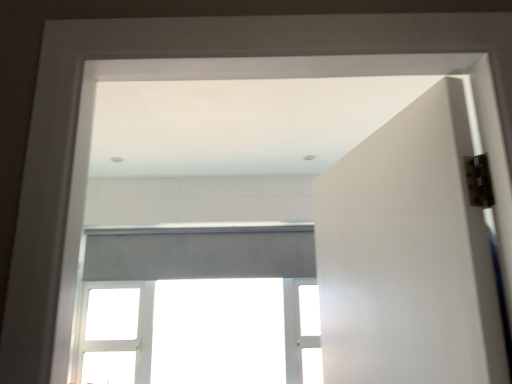
Question: Should I look upward or downward to see white matte door at right?

Choices:
 (A) down
 (B) up

Answer: (A)

Question: Considering the relative sizes of white matte door at right and white matte window at center in the image provided, is white matte door at right smaller than white matte window at center?

Choices:
 (A) yes
 (B) no

Answer: (A)

Question: From a real-world perspective, is white matte door at right located beneath white matte window at center?

Choices:
 (A) yes
 (B) no

Answer: (B)

Question: Is the position of white matte door at right less distant than that of white matte window at center?

Choices:
 (A) no
 (B) yes

Answer: (B)

Question: Is white matte door at right at the right side of white matte window at center?

Choices:
 (A) no
 (B) yes

Answer: (B)

Question: Is white matte door at right further to camera compared to white matte window at center?

Choices:
 (A) yes
 (B) no

Answer: (B)

Question: Is white matte door at right at the left side of white matte window at center?

Choices:
 (A) yes
 (B) no

Answer: (B)

Question: Can you confirm if white matte window at center is positioned to the right of white matte door at right?

Choices:
 (A) no
 (B) yes

Answer: (A)

Question: Is white matte window at center smaller than white matte door at right?

Choices:
 (A) no
 (B) yes

Answer: (A)

Question: Can you see white matte window at center touching white matte door at right?

Choices:
 (A) no
 (B) yes

Answer: (A)

Question: From the image's perspective, is white matte window at center on top of white matte door at right?

Choices:
 (A) yes
 (B) no

Answer: (B)

Question: From a real-world perspective, is white matte window at center on white matte door at right?

Choices:
 (A) yes
 (B) no

Answer: (B)

Question: Could you tell me if white matte window at center is turned towards white matte door at right?

Choices:
 (A) no
 (B) yes

Answer: (B)

Question: From a real-world perspective, is white matte window at center above or below white matte door at right?

Choices:
 (A) below
 (B) above

Answer: (A)